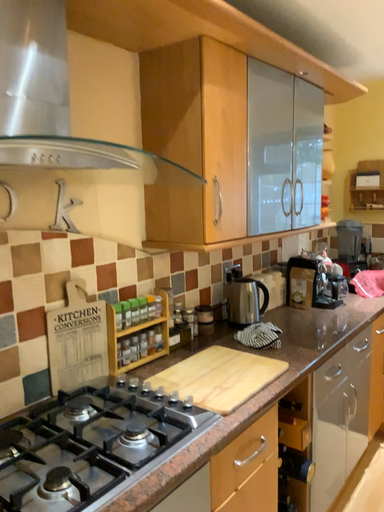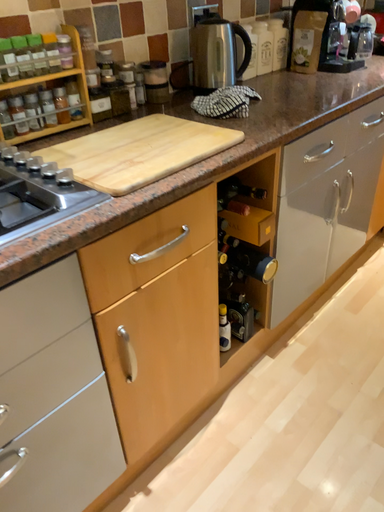
Question: How did the camera likely rotate when shooting the video?

Choices:
 (A) rotated upward
 (B) rotated downward

Answer: (B)